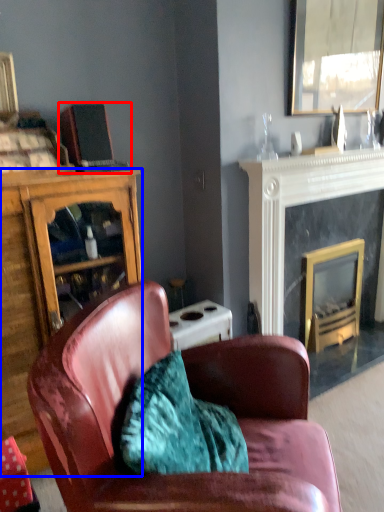
Question: Which point is further to the camera, laptop (highlighted by a red box) or cabinetry (highlighted by a blue box)?

Choices:
 (A) laptop
 (B) cabinetry

Answer: (A)